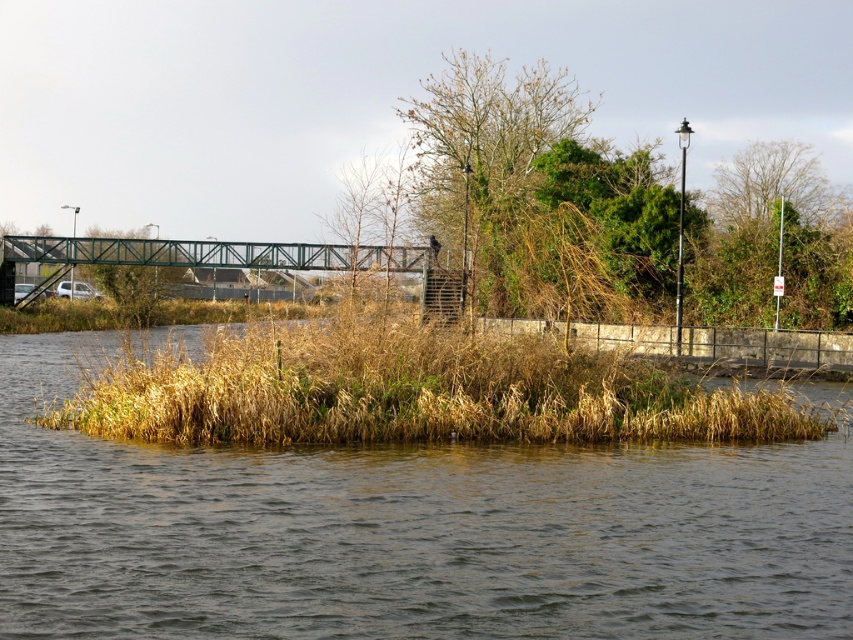
You are standing on the riverside path and see the brown grass at center and the green metallic bridge at center. Which object is nearer to you?

The brown grass at center is closer to the viewer than the green metallic bridge at center, so the brown grass at center is nearer to you.

You are a bird flying over the riverside scene. You see the brown grassy island at center and the green metallic bridge at center. Which object is closer to you from your bird perspective?

The green metallic bridge at center is closer to you because it is positioned over the brown grassy island at center, meaning the bridge is above the island in the scene.